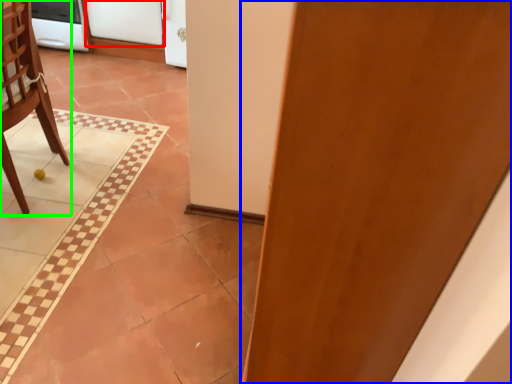
Question: Which object is positioned farthest from screen door (highlighted by a red box)? Select from door (highlighted by a blue box) and chair (highlighted by a green box).

Choices:
 (A) door
 (B) chair

Answer: (A)